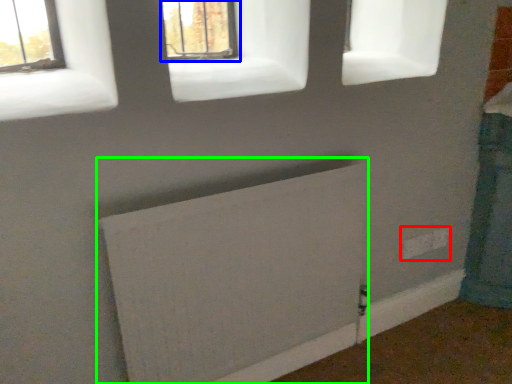
Question: Which object is the closest to the electric outlet (highlighted by a red box)? Choose among these: window (highlighted by a blue box) or radiator (highlighted by a green box).

Choices:
 (A) window
 (B) radiator

Answer: (B)